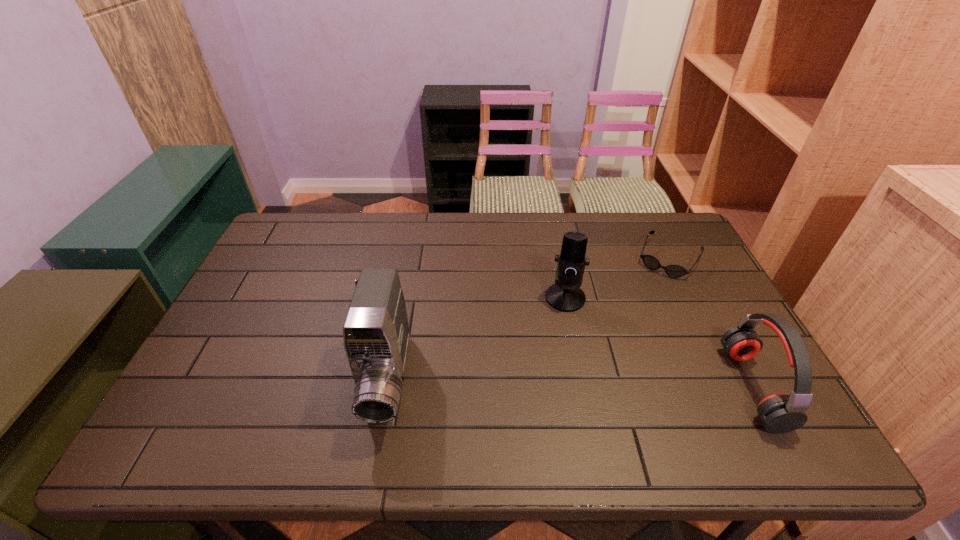
This screenshot has width=960, height=540. I want to click on vacant space located on the lenses of the shortest object, so click(x=629, y=335).

At what (x,y) coordinates should I click in order to perform the action: click on free spot located 0.060m on the lenses of the shortest object. Please return your answer as a coordinate pair (x, y). Looking at the image, I should click on (654, 288).

Where is `free space located on the stand of the second object from left to right`? Image resolution: width=960 pixels, height=540 pixels. free space located on the stand of the second object from left to right is located at coordinates (528, 384).

Identify the location of free space located 0.340m on the stand of the second object from left to right. Image resolution: width=960 pixels, height=540 pixels. click(x=518, y=408).

Identify the location of vacant area situated 0.290m on the stand of the second object from left to right. This screenshot has height=540, width=960. (525, 391).

Find the location of a particular element. The height and width of the screenshot is (540, 960). object at the far edge is located at coordinates (651, 262).

In order to click on camcorder present at the near edge in this screenshot , I will do `click(376, 333)`.

You are a GUI agent. You are given a task and a screenshot of the screen. Output one action in this format:
    pyautogui.click(x=<x>, y=<y>)
    Task: Click on the earphone at the near edge
    
    Given the screenshot: What is the action you would take?
    pyautogui.click(x=780, y=413)

The height and width of the screenshot is (540, 960). In order to click on earphone at the right edge in this screenshot , I will do (780, 413).

I want to click on sunglasses at the right edge, so (651, 262).